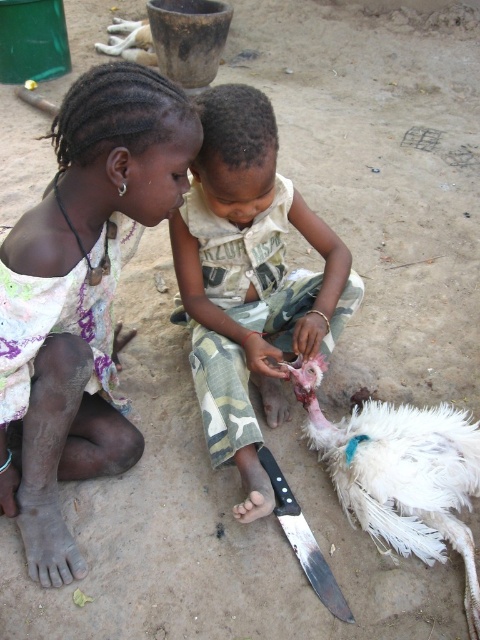
Does matte white dress at left have a larger size compared to white feathered bird at lower right?

Yes, matte white dress at left is bigger than white feathered bird at lower right.

Who is shorter, matte white dress at left or white feathered bird at lower right?

white feathered bird at lower right

Which is behind, point (104, 88) or point (371, 529)?

The point (371, 529) is more distant.

At what (x,y) coordinates should I click in order to perform the action: click on matte white dress at left. Please return your answer as a coordinate pair (x, y). Looking at the image, I should click on (82, 296).

Does camouflage pants at center appear on the left side of white feathered bird at lower right?

Yes, camouflage pants at center is to the left of white feathered bird at lower right.

In the scene shown: Can you confirm if camouflage pants at center is positioned to the right of white feathered bird at lower right?

Incorrect, camouflage pants at center is not on the right side of white feathered bird at lower right.

Does point (229, 157) come behind point (479, 445)?

No.

The image size is (480, 640). I want to click on camouflage pants at center, so click(x=250, y=280).

Is matte white dress at left positioned at the back of black plastic knife at lower center?

No, matte white dress at left is closer to the viewer.

Is matte white dress at left bigger than black plastic knife at lower center?

Correct, matte white dress at left is larger in size than black plastic knife at lower center.

Measure the distance between matte white dress at left and camera.

The distance of matte white dress at left from camera is 3.92 feet.

At what (x,y) coordinates should I click in order to perform the action: click on matte white dress at left. Please return your answer as a coordinate pair (x, y). Looking at the image, I should click on (82, 296).